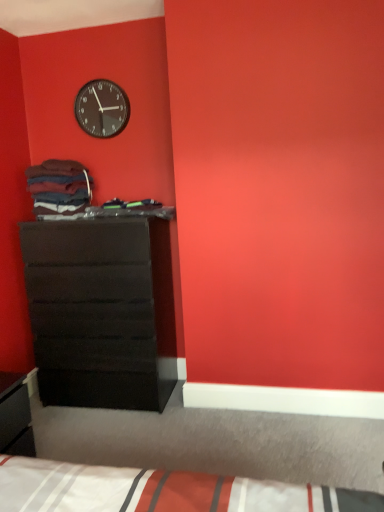
Question: Would you say matte black clock at upper left is outside matte black chest of drawers at left?

Choices:
 (A) yes
 (B) no

Answer: (A)

Question: Does matte black clock at upper left touch matte black chest of drawers at left?

Choices:
 (A) yes
 (B) no

Answer: (B)

Question: Can you confirm if matte black clock at upper left is wider than matte black chest of drawers at left?

Choices:
 (A) no
 (B) yes

Answer: (A)

Question: Does matte black clock at upper left turn towards matte black chest of drawers at left?

Choices:
 (A) no
 (B) yes

Answer: (A)

Question: Is matte black clock at upper left at the right side of matte black chest of drawers at left?

Choices:
 (A) yes
 (B) no

Answer: (B)

Question: In the image, is matte black clock at upper left on the left side or the right side of white striped fabric bed at lower center?

Choices:
 (A) right
 (B) left

Answer: (B)

Question: Would you say matte black clock at upper left is inside or outside white striped fabric bed at lower center?

Choices:
 (A) outside
 (B) inside

Answer: (A)

Question: Considering the positions of matte black clock at upper left and white striped fabric bed at lower center in the image, is matte black clock at upper left wider or thinner than white striped fabric bed at lower center?

Choices:
 (A) wide
 (B) thin

Answer: (B)

Question: Does point (102, 100) appear closer or farther from the camera than point (119, 501)?

Choices:
 (A) closer
 (B) farther

Answer: (B)

Question: Is white striped fabric bed at lower center situated inside matte black chest of drawers at left or outside?

Choices:
 (A) outside
 (B) inside

Answer: (A)

Question: From the image's perspective, is white striped fabric bed at lower center located above or below matte black chest of drawers at left?

Choices:
 (A) above
 (B) below

Answer: (B)

Question: Considering their positions, is white striped fabric bed at lower center located in front of or behind matte black chest of drawers at left?

Choices:
 (A) front
 (B) behind

Answer: (A)

Question: In terms of width, does white striped fabric bed at lower center look wider or thinner when compared to matte black chest of drawers at left?

Choices:
 (A) thin
 (B) wide

Answer: (B)

Question: From the image's perspective, is matte black chest of drawers at left above or below white striped fabric bed at lower center?

Choices:
 (A) above
 (B) below

Answer: (A)

Question: In the image, is matte black chest of drawers at left on the left side or the right side of white striped fabric bed at lower center?

Choices:
 (A) right
 (B) left

Answer: (B)